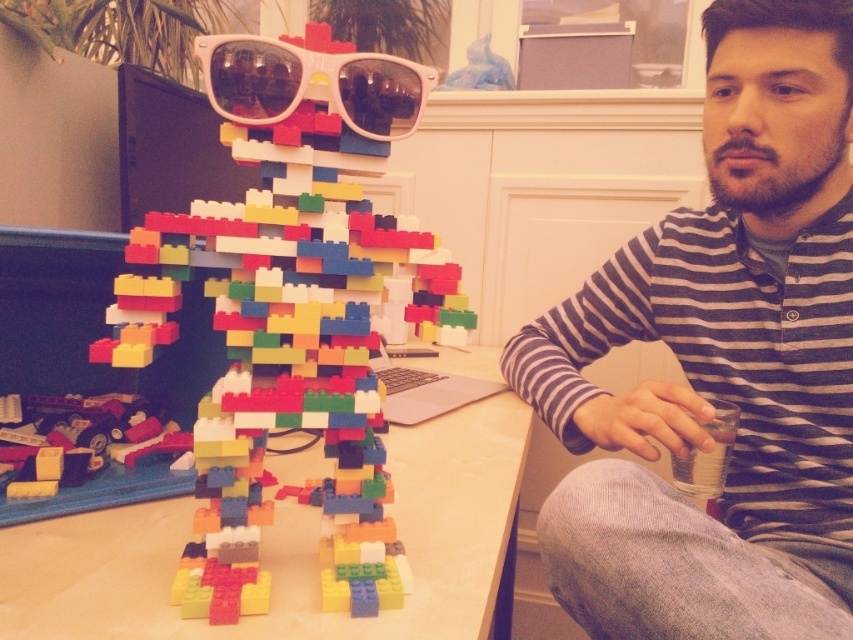
Consider the image. Does striped cotton shirt at upper right have a greater height compared to multicolored plastic blocks at center?

Yes, striped cotton shirt at upper right is taller than multicolored plastic blocks at center.

Where is `striped cotton shirt at upper right`? The height and width of the screenshot is (640, 853). striped cotton shirt at upper right is located at coordinates (720, 362).

Does point (799, 340) lie in front of point (253, 49)?

No.

Image resolution: width=853 pixels, height=640 pixels. What are the coordinates of `striped cotton shirt at upper right` in the screenshot? It's located at (720, 362).

Can you confirm if striped cotton shirt at upper right is positioned below wooden table at center?

No.

The width and height of the screenshot is (853, 640). Identify the location of striped cotton shirt at upper right. (720, 362).

This screenshot has width=853, height=640. In order to click on striped cotton shirt at upper right in this screenshot , I will do `click(720, 362)`.

Can you confirm if wooden table at center is positioned to the left of white plastic sunglasses at upper center?

No, wooden table at center is not to the left of white plastic sunglasses at upper center.

Does point (517, 419) lie in front of point (358, 65)?

No, (517, 419) is behind (358, 65).

This screenshot has width=853, height=640. What do you see at coordinates (288, 548) in the screenshot? I see `wooden table at center` at bounding box center [288, 548].

Find the location of a particular element. wooden table at center is located at coordinates (288, 548).